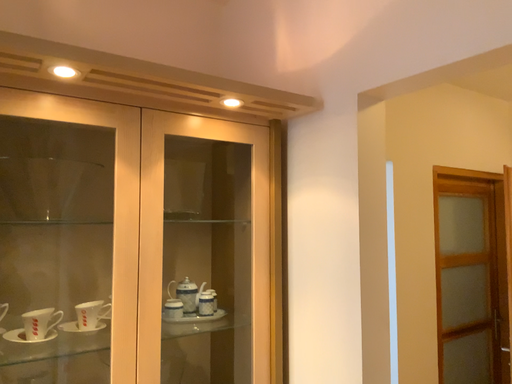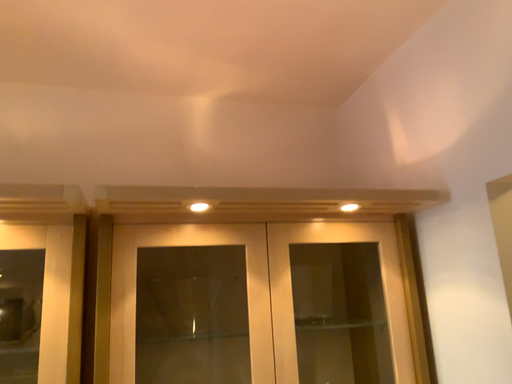
Question: How did the camera likely rotate when shooting the video?

Choices:
 (A) rotated left
 (B) rotated right

Answer: (A)